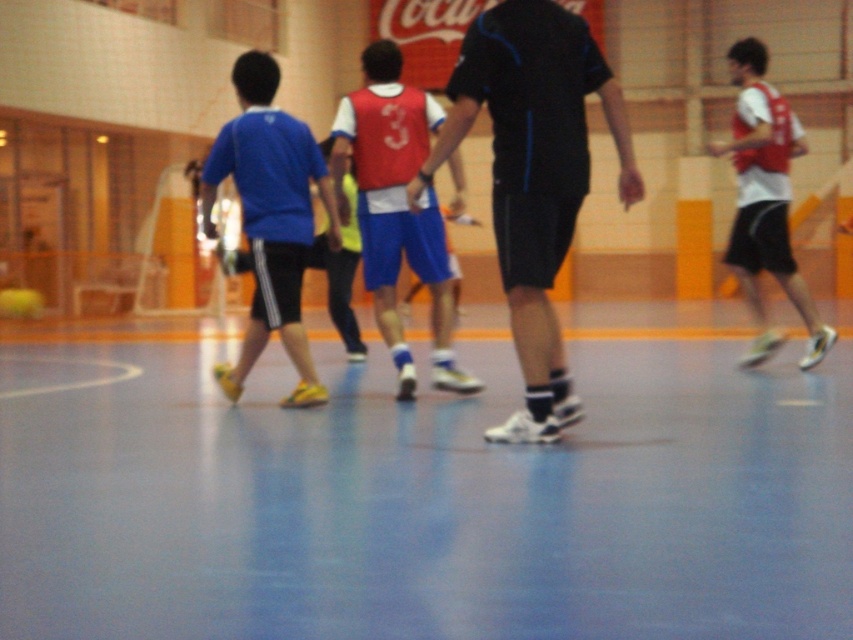
Question: Estimate the real-world distances between objects in this image. Which object is closer to the white matte jersey at right?

Choices:
 (A) matte blue shorts at left
 (B) black matte shorts at center

Answer: (B)

Question: Is matte red jersey at center above white matte jersey at right?

Choices:
 (A) no
 (B) yes

Answer: (A)

Question: Among these points, which one is nearest to the camera?

Choices:
 (A) (758, 154)
 (B) (445, 300)
 (C) (318, 394)

Answer: (C)

Question: Is black matte shorts at center below matte blue shorts at left?

Choices:
 (A) yes
 (B) no

Answer: (A)

Question: Which point is closer to the camera taking this photo?

Choices:
 (A) (741, 45)
 (B) (531, 221)
 (C) (264, 275)
 (D) (409, 93)

Answer: (B)

Question: Is black matte shorts at center bigger than matte red jersey at center?

Choices:
 (A) yes
 (B) no

Answer: (A)